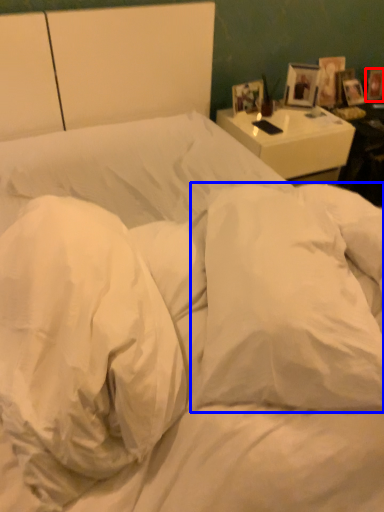
Question: Among these objects, which one is farthest to the camera, picture frame (highlighted by a red box) or pillow (highlighted by a blue box)?

Choices:
 (A) picture frame
 (B) pillow

Answer: (A)